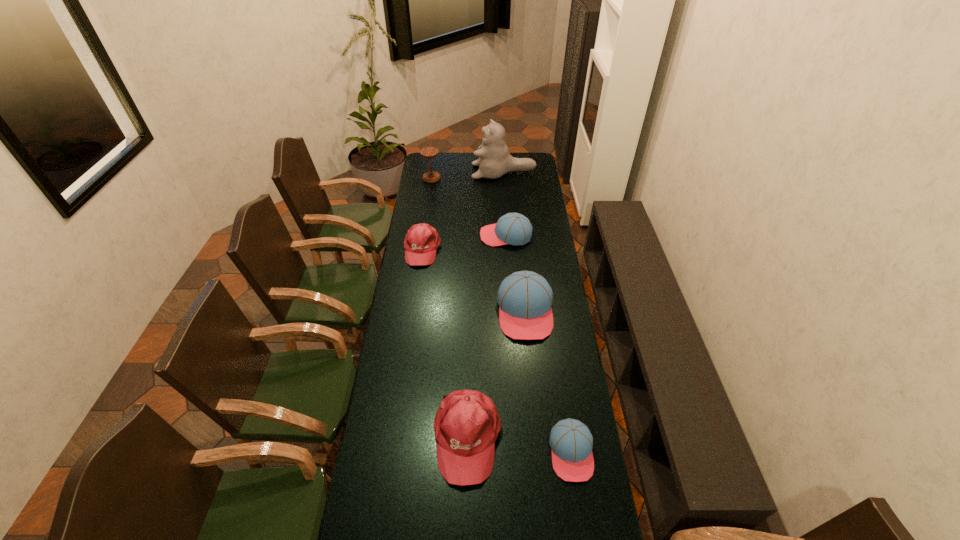
Identify the location of green cat. (494, 161).

Where is `the tallest object`? the tallest object is located at coordinates (494, 161).

Where is `hourglass`? This screenshot has height=540, width=960. hourglass is located at coordinates (428, 153).

Identify the location of the biggest blue baseball cap. Image resolution: width=960 pixels, height=540 pixels. (525, 298).

You are a GUI agent. You are given a task and a screenshot of the screen. Output one action in this format:
    pyautogui.click(x=<x>, y=<y>)
    Task: Click on the fifth farthest object
    The height and width of the screenshot is (540, 960).
    Given the screenshot: What is the action you would take?
    pyautogui.click(x=525, y=298)

Identify the location of the nearer red baseball cap. This screenshot has width=960, height=540. (467, 423).

The image size is (960, 540). Find the location of `the right red baseball cap`. the right red baseball cap is located at coordinates tap(467, 423).

Identify the location of the farthest blue baseball cap. The image size is (960, 540). (512, 228).

This screenshot has height=540, width=960. What are the coordinates of `the leftmost baseball cap` in the screenshot? It's located at (422, 240).

You are a GUI agent. You are given a task and a screenshot of the screen. Output one action in this format:
    pyautogui.click(x=<x>, y=<y>)
    Task: Click on the smaller red baseball cap
    The image size is (960, 540).
    Given the screenshot: What is the action you would take?
    pyautogui.click(x=422, y=240)